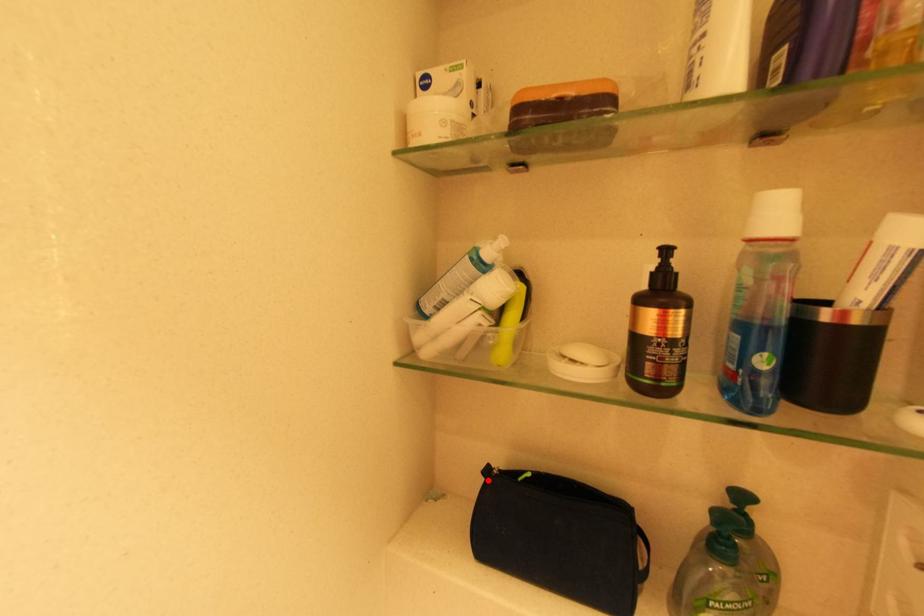
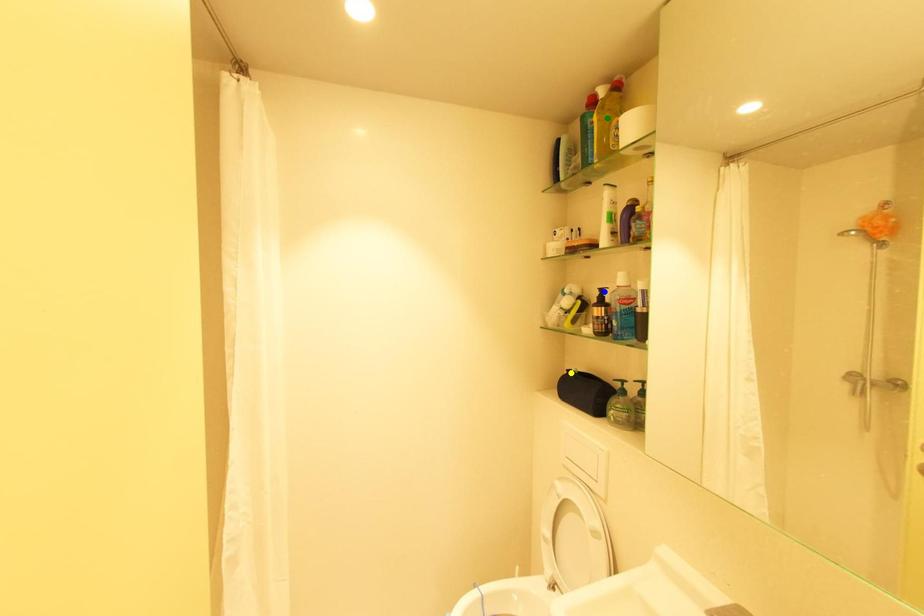
Question: I am providing you with two images of the same scene from different viewpoints. A red point is marked on the first image. You are given multiple points on the second image. Which point in image 2 is actually the same real-world point as the red point in image 1?

Choices:
 (A) green point
 (B) blue point
 (C) yellow point

Answer: (C)